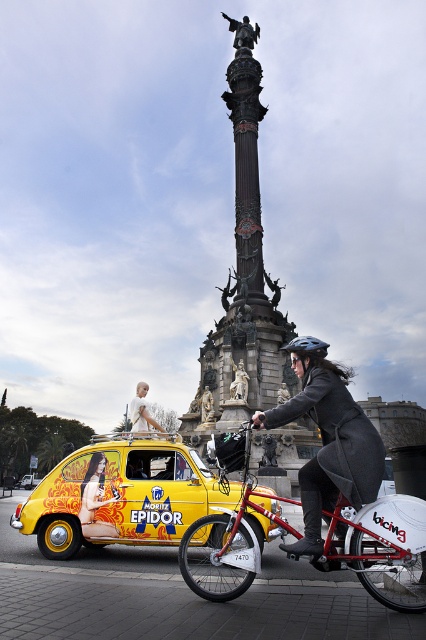
Question: Which of the following is the closest to the observer?

Choices:
 (A) (141, 410)
 (B) (319, 342)
 (C) (37, 483)
 (D) (89, 499)

Answer: (D)

Question: Which point is farther to the camera?

Choices:
 (A) 324,424
 (B) 259,243
 (C) 131,419

Answer: (B)

Question: Does matte yellow car at center appear over yellow matte vintage car at center?

Choices:
 (A) yes
 (B) no

Answer: (A)

Question: Estimate the real-world distances between objects in this image. Which object is closer to the yellow matte vintage car at center?

Choices:
 (A) gray wool coat at center
 (B) dark stone column at center
 (C) metallic red bicycle at center
 (D) matte yellow car at center

Answer: (D)

Question: Does dark stone column at center have a smaller size compared to yellow matte taxi at center?

Choices:
 (A) no
 (B) yes

Answer: (A)

Question: Is metallic red bicycle at center smaller than matte yellow car at center?

Choices:
 (A) yes
 (B) no

Answer: (B)